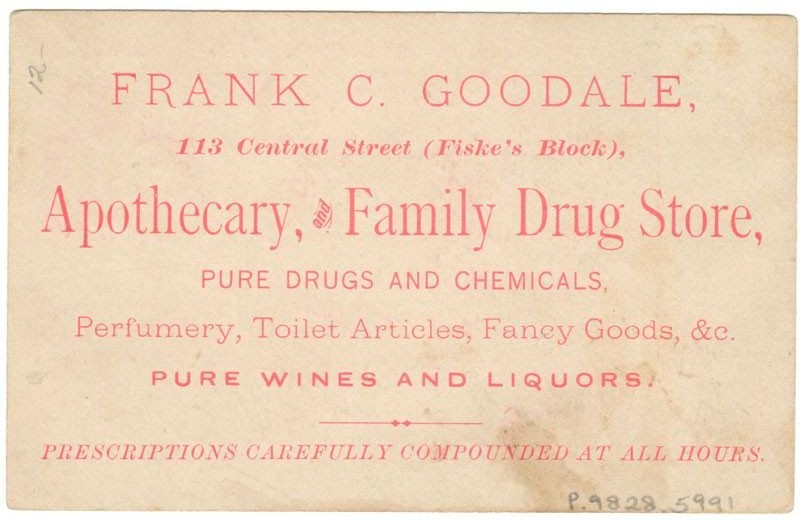
This screenshot has height=520, width=800. Find the location of `stain`. stain is located at coordinates (541, 474).